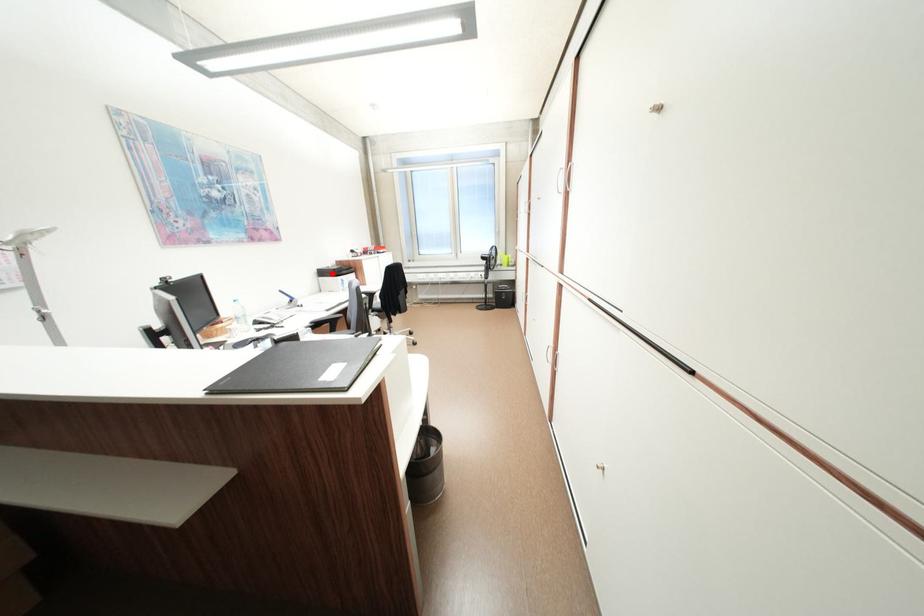
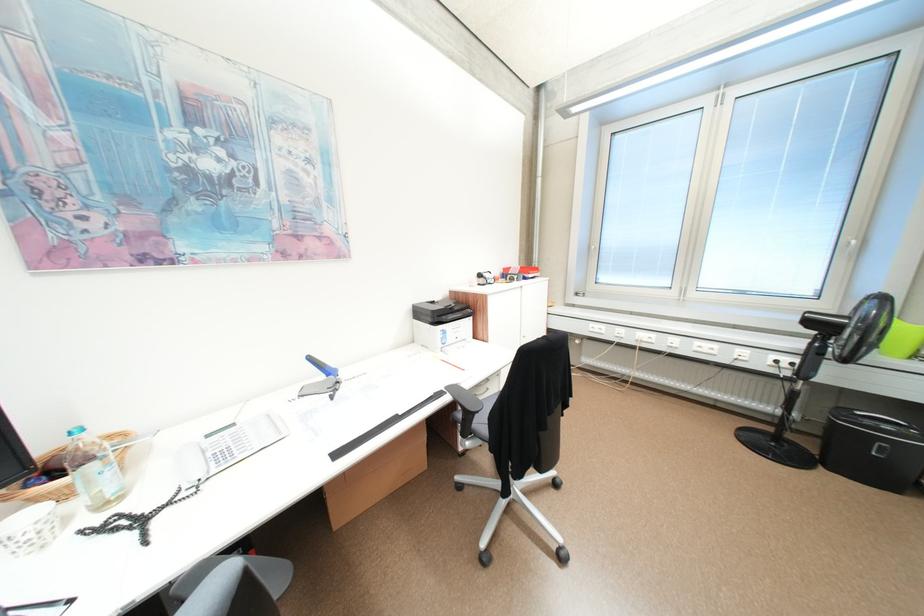
Find the pixel in the second image that matches the highlighted location in the first image.

(428, 313)